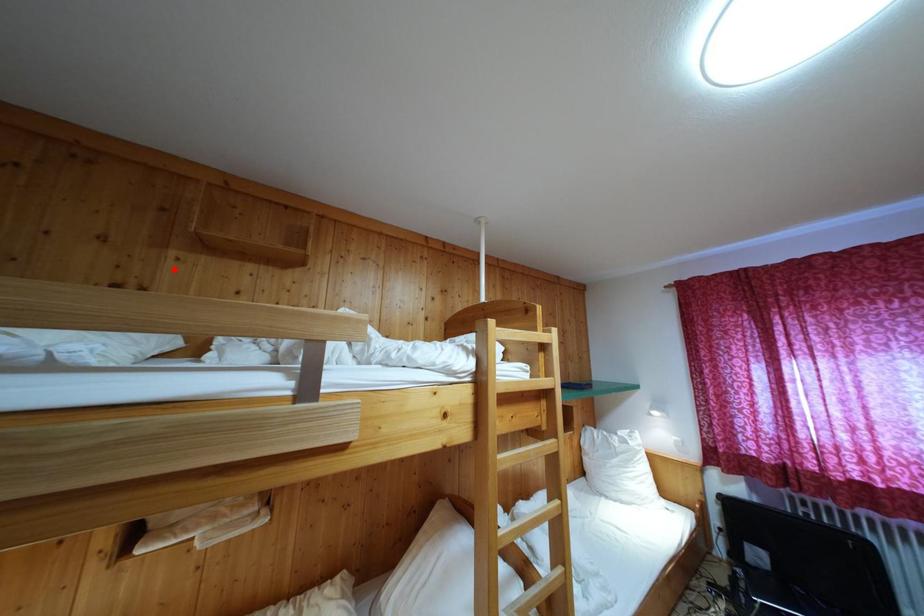
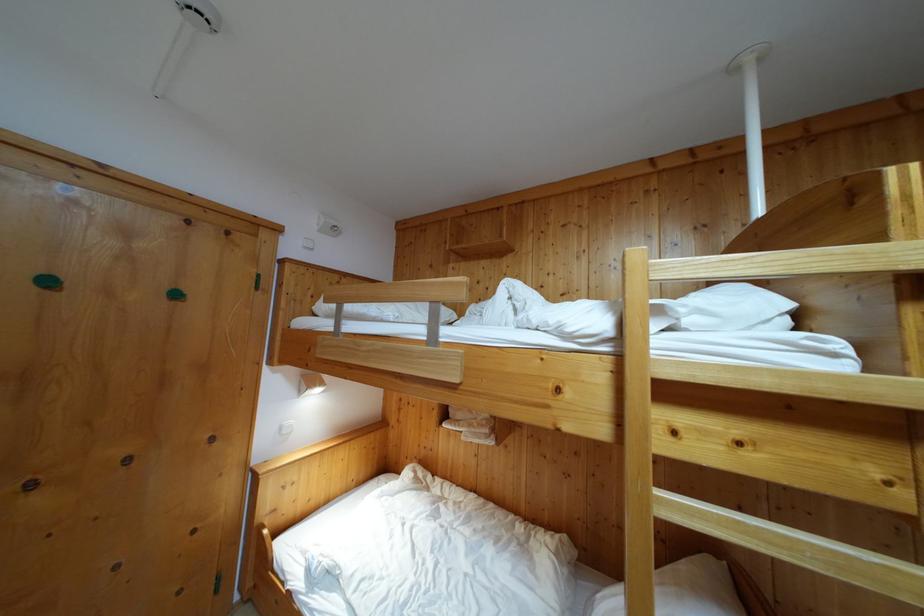
Question: I am providing you with two images of the same scene from different viewpoints. A red point is marked on the first image. Is the red point's position out of view in image 2?

Choices:
 (A) Yes
 (B) No

Answer: (B)